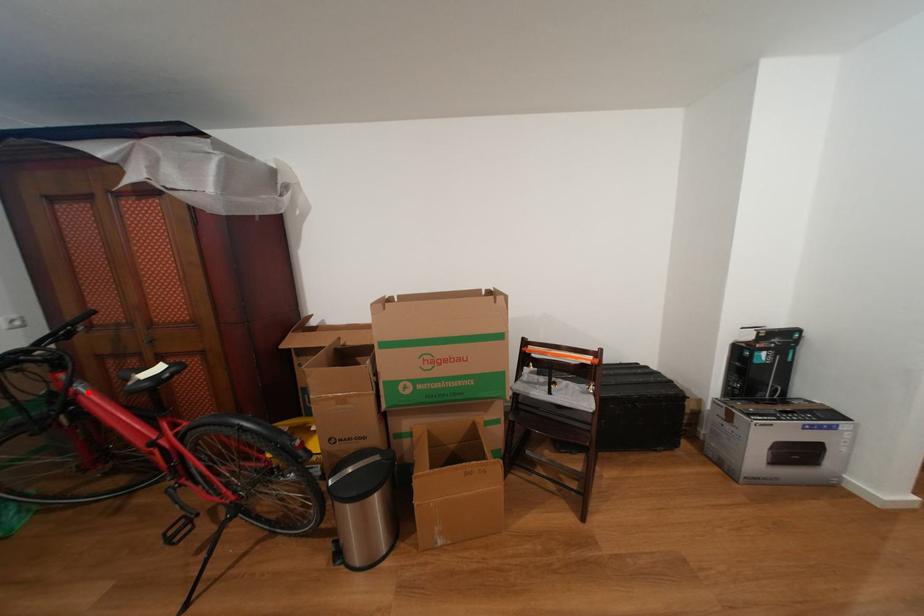
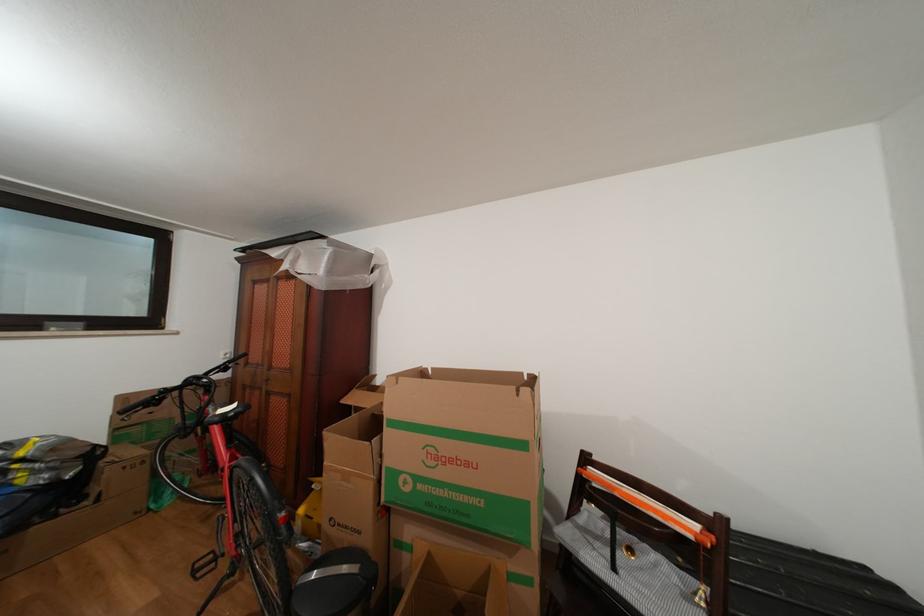
Find the pixel in the second image that matches the highlighted location in the first image.

(219, 414)